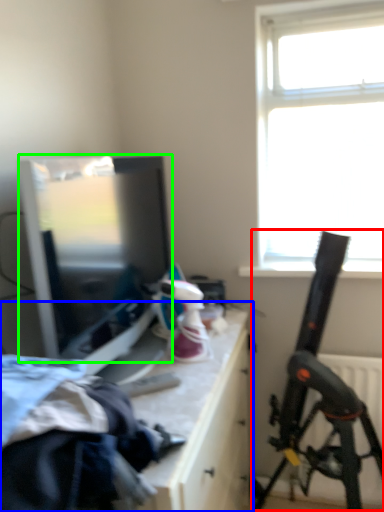
Question: Which is farther away from weapon (highlighted by a red box)? table (highlighted by a blue box) or window screen (highlighted by a green box)?

Choices:
 (A) table
 (B) window screen

Answer: (B)